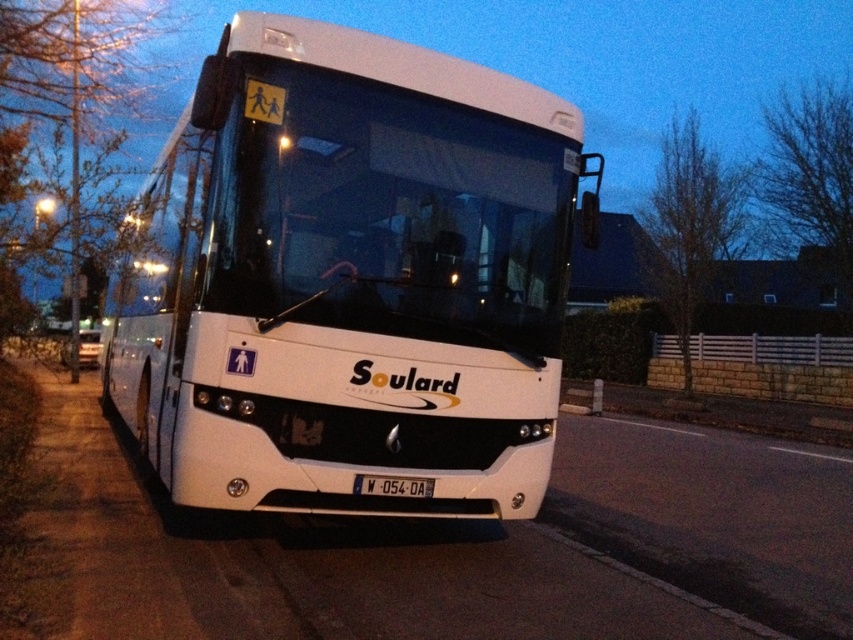
From the picture: Is white matte bus at center smaller than black plastic license plate at center?

No.

Does white matte bus at center appear under black plastic license plate at center?

No.

Where is `white matte bus at center`? The height and width of the screenshot is (640, 853). white matte bus at center is located at coordinates pos(349,280).